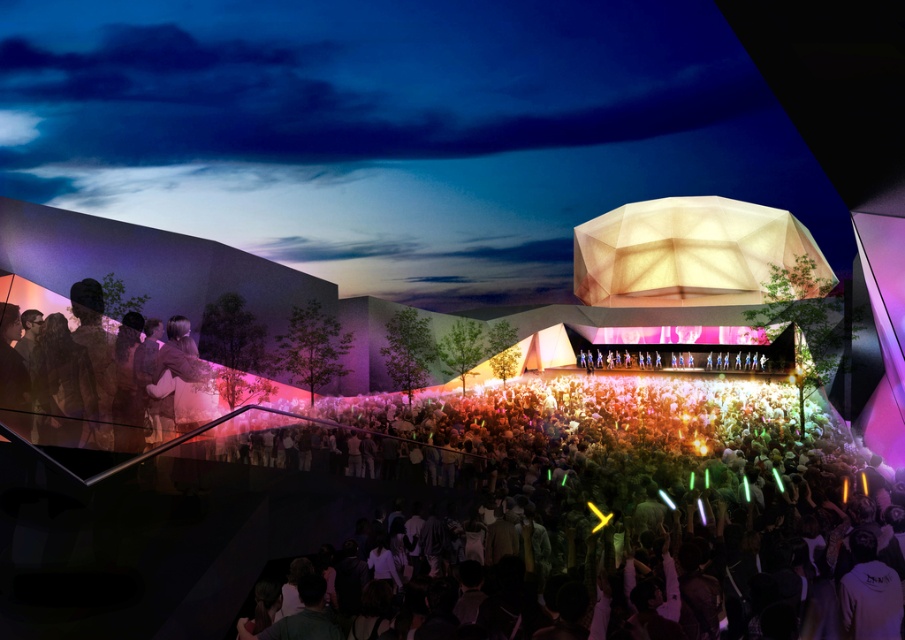
Question: Can you confirm if multicolored glow sticks at center is thinner than silhouette fabric at left?

Choices:
 (A) no
 (B) yes

Answer: (A)

Question: Which object is farther from the camera taking this photo?

Choices:
 (A) silhouette fabric at left
 (B) multicolored glow sticks at center

Answer: (A)

Question: Which object appears closest to the camera in this image?

Choices:
 (A) silhouette fabric at left
 (B) multicolored glow sticks at center

Answer: (B)

Question: Observing the image, what is the correct spatial positioning of multicolored glow sticks at center in reference to silhouette fabric at left?

Choices:
 (A) right
 (B) left

Answer: (A)

Question: From the image, what is the correct spatial relationship of multicolored glow sticks at center in relation to silhouette fabric at left?

Choices:
 (A) above
 (B) below

Answer: (B)